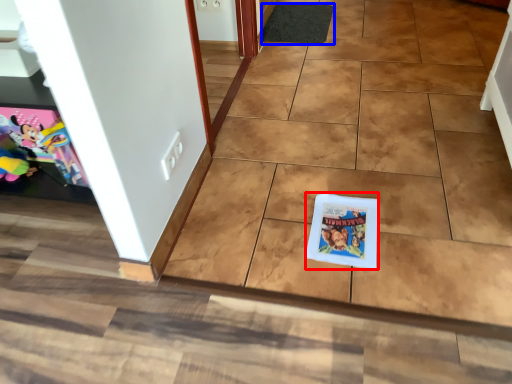
Question: Which point is closer to the camera, comic book (highlighted by a red box) or doormat (highlighted by a blue box)?

Choices:
 (A) comic book
 (B) doormat

Answer: (A)